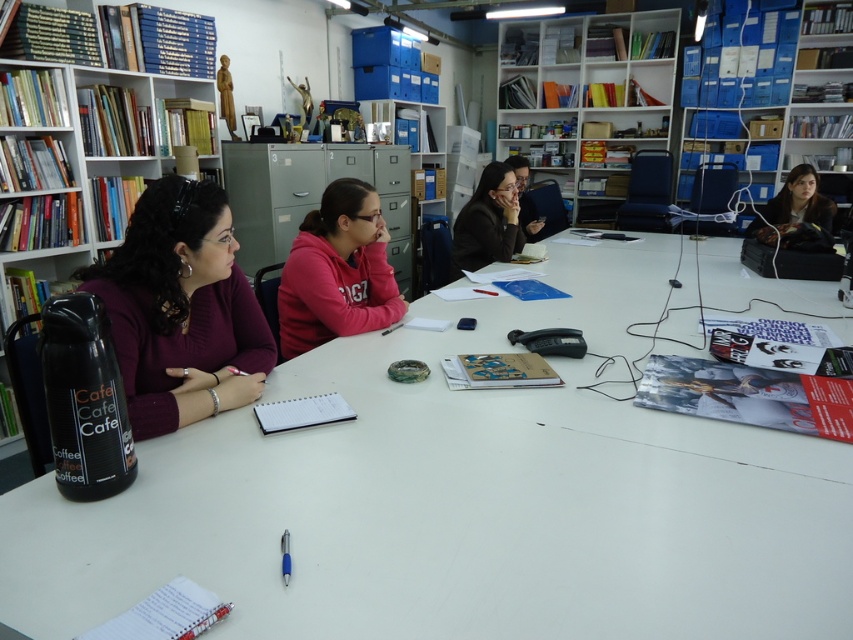
You are organizing a study session and need to place a matte pink hoodie at center on the white plastic bookshelf at upper center. Is the hoodie positioned to the left or right of the bookshelf?

The matte pink hoodie at center is to the left of the white plastic bookshelf at upper center because the bookshelf is on the right side of the hoodie.

You are a person who is 1.7 meters tall and standing in front of the matte pink hoodie at center. You want to reach a book on the top shelf of the bookshelf on the left side. Can you safely reach it without needing a ladder?

The distance between the matte pink hoodie at center and the camera is 2.04 meters, but this information does not provide details about the height of the bookshelf or the person. Since the person is 1.7 meters tall, they may not be able to reach the top shelf without a ladder, as typical bookshelves are around 1.8 to 2 meters tall. However, without specific height data for the bookshelf, we cannot confirm.